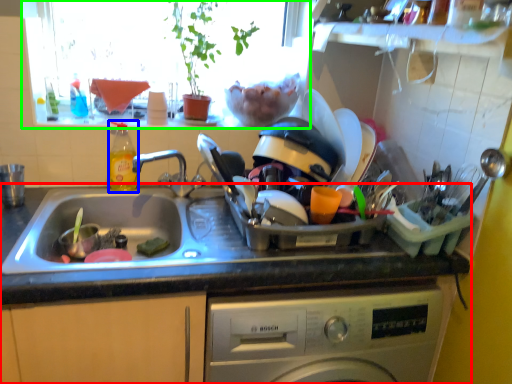
Question: Which is farther away from countertop (highlighted by a red box)? bottle (highlighted by a blue box) or window screen (highlighted by a green box)?

Choices:
 (A) bottle
 (B) window screen

Answer: (B)